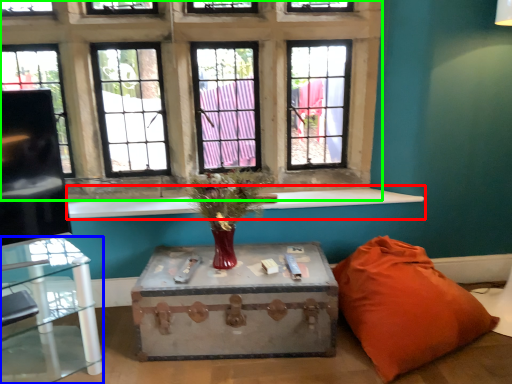
Question: Considering the real-world distances, which object is closest to window sill (highlighted by a red box)? table (highlighted by a blue box) or window (highlighted by a green box).

Choices:
 (A) table
 (B) window

Answer: (A)